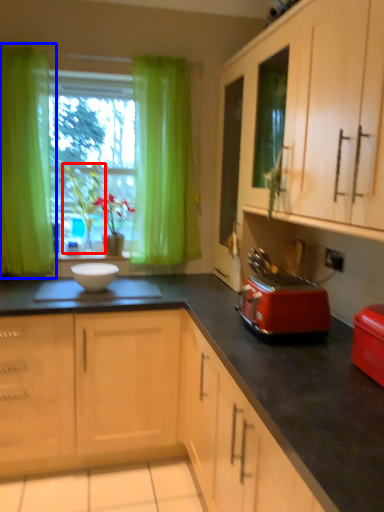
Question: Which object is further to the camera taking this photo, plant (highlighted by a red box) or curtain (highlighted by a blue box)?

Choices:
 (A) plant
 (B) curtain

Answer: (A)